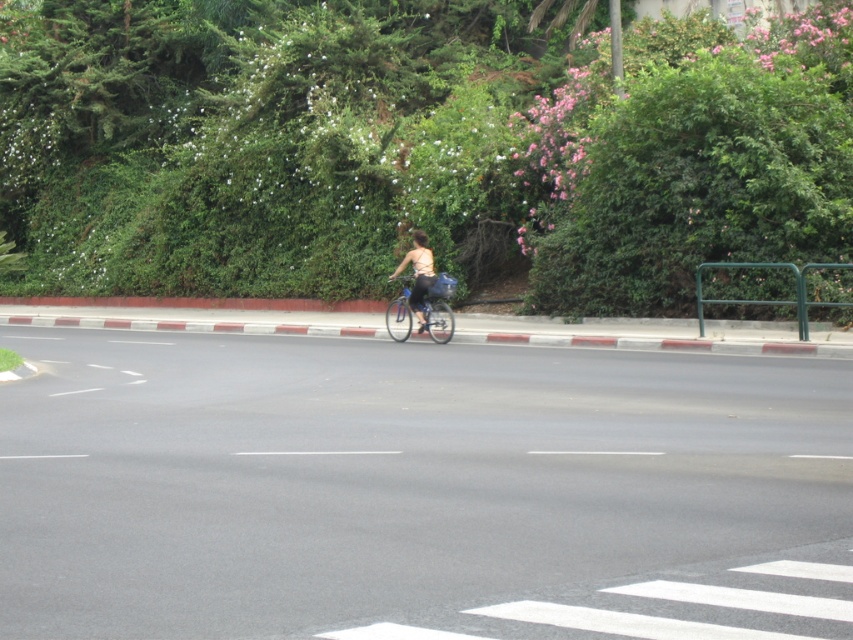
Is shiny metallic bicycle at center to the left of matte beige tank top at center from the viewer's perspective?

Yes, shiny metallic bicycle at center is to the left of matte beige tank top at center.

Which is below, shiny metallic bicycle at center or matte beige tank top at center?

Positioned lower is shiny metallic bicycle at center.

Is point (440, 276) behind point (412, 308)?

No, it is in front of (412, 308).

Identify the location of shiny metallic bicycle at center. (439, 308).